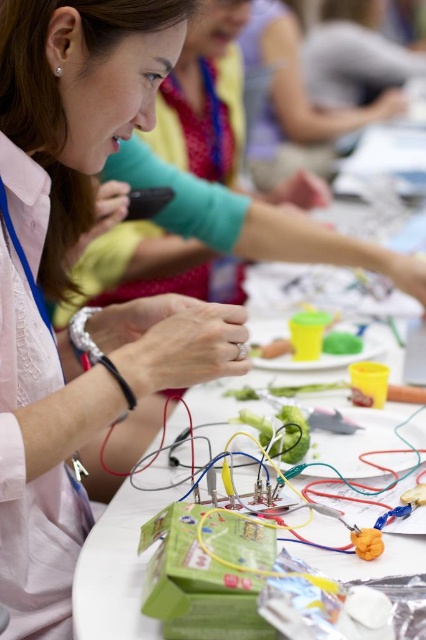
In the scene shown: Can you confirm if matte pink shirt at center is positioned to the left of matte green shirt at upper center?

Indeed, matte pink shirt at center is positioned on the left side of matte green shirt at upper center.

Who is lower down, matte pink shirt at center or matte green shirt at upper center?

matte pink shirt at center

Image resolution: width=426 pixels, height=640 pixels. In order to click on matte pink shirt at center in this screenshot , I will do `click(71, 282)`.

This screenshot has width=426, height=640. What are the coordinates of `matte pink shirt at center` in the screenshot? It's located at (71, 282).

Does white paper at center come in front of matte green shirt at upper center?

Yes.

Does white paper at center appear on the right side of matte green shirt at upper center?

No, white paper at center is not to the right of matte green shirt at upper center.

The image size is (426, 640). What are the coordinates of `white paper at center` in the screenshot? It's located at (115, 572).

Which is below, matte pink shirt at center or white paper at center?

Positioned lower is white paper at center.

Is matte pink shirt at center positioned in front of white paper at center?

Yes, matte pink shirt at center is in front of white paper at center.

Where is `matte pink shirt at center`? matte pink shirt at center is located at coordinates (71, 282).